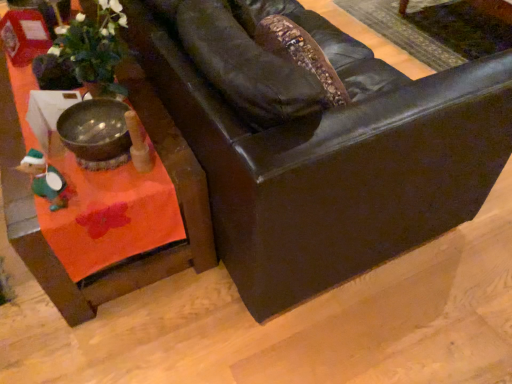
Question: Is orange fabric table at lower left far away from green felt toy at lower left?

Choices:
 (A) yes
 (B) no

Answer: (B)

Question: Can you confirm if orange fabric table at lower left is positioned to the left of green felt toy at lower left?

Choices:
 (A) no
 (B) yes

Answer: (B)

Question: Is the position of orange fabric table at lower left less distant than that of green felt toy at lower left?

Choices:
 (A) no
 (B) yes

Answer: (A)

Question: Is orange fabric table at lower left further to the viewer compared to green felt toy at lower left?

Choices:
 (A) no
 (B) yes

Answer: (B)

Question: Considering the relative sizes of orange fabric table at lower left and green felt toy at lower left in the image provided, is orange fabric table at lower left shorter than green felt toy at lower left?

Choices:
 (A) no
 (B) yes

Answer: (A)

Question: Do you think orange fabric table at lower left is within green felt toy at lower left, or outside of it?

Choices:
 (A) outside
 (B) inside

Answer: (A)

Question: In terms of size, does orange fabric table at lower left appear bigger or smaller than green felt toy at lower left?

Choices:
 (A) small
 (B) big

Answer: (B)

Question: From a real-world perspective, is orange fabric table at lower left above or below green felt toy at lower left?

Choices:
 (A) below
 (B) above

Answer: (A)

Question: Does point (205, 196) appear closer or farther from the camera than point (60, 203)?

Choices:
 (A) farther
 (B) closer

Answer: (A)

Question: From a real-world perspective, is green felt toy at lower left physically located above or below matte black leather couch at center?

Choices:
 (A) above
 (B) below

Answer: (A)

Question: Considering the positions of green felt toy at lower left and matte black leather couch at center in the image, is green felt toy at lower left wider or thinner than matte black leather couch at center?

Choices:
 (A) thin
 (B) wide

Answer: (A)

Question: From their relative heights in the image, would you say green felt toy at lower left is taller or shorter than matte black leather couch at center?

Choices:
 (A) short
 (B) tall

Answer: (A)

Question: Is green felt toy at lower left inside the boundaries of matte black leather couch at center, or outside?

Choices:
 (A) inside
 (B) outside

Answer: (B)

Question: Would you say orange fabric table at lower left is inside or outside matte black leather couch at center?

Choices:
 (A) outside
 (B) inside

Answer: (A)

Question: Is orange fabric table at lower left in front of or behind matte black leather couch at center in the image?

Choices:
 (A) front
 (B) behind

Answer: (B)